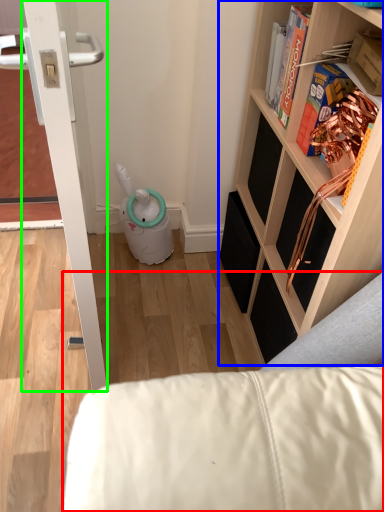
Question: Which object is positioned farthest from furniture (highlighted by a red box)? Select from shelf (highlighted by a blue box) and door (highlighted by a green box).

Choices:
 (A) shelf
 (B) door

Answer: (B)